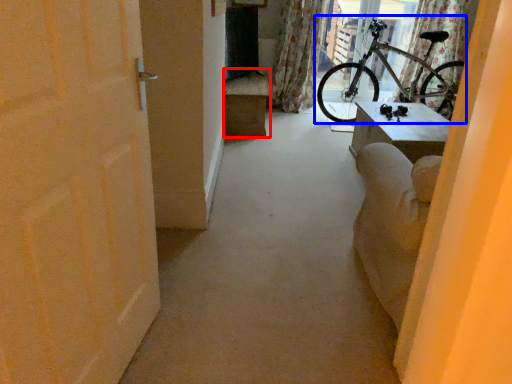
Question: Which point is closer to the camera, furniture (highlighted by a red box) or bicycle (highlighted by a blue box)?

Choices:
 (A) furniture
 (B) bicycle

Answer: (B)